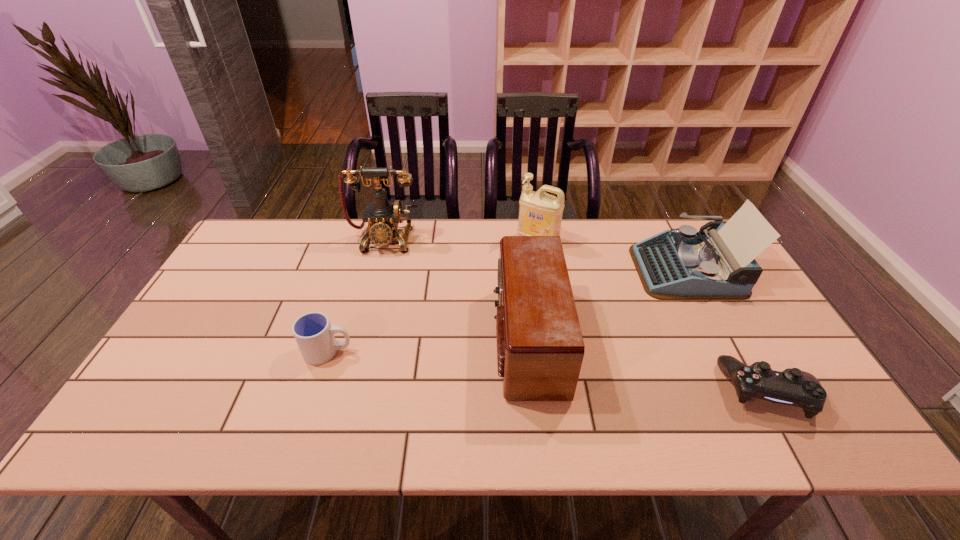
I want to click on vacant point located between the radio receiver and the typewriter, so click(x=607, y=304).

This screenshot has width=960, height=540. What are the coordinates of `vacant space that's between the radio receiver and the control` in the screenshot? It's located at (648, 365).

The width and height of the screenshot is (960, 540). What are the coordinates of `free space that is in between the typewriter and the control` in the screenshot? It's located at (728, 330).

Identify the location of unoccupied position between the control and the typewriter. The height and width of the screenshot is (540, 960). (728, 330).

The width and height of the screenshot is (960, 540). Identify the location of object identified as the second closest to the cup. (540, 348).

Identify which object is the second nearest to the telephone. Please provide its 2D coordinates. Your answer should be formatted as a tuple, i.e. [(x, y)], where the tuple contains the x and y coordinates of a point satisfying the conditions above.

[(540, 214)]

Where is `vacant space that satisfies the following two spatial constraints: 1. on the front of the detergent, featuring the rotary dial; 2. on the right side of the telephone`? This screenshot has width=960, height=540. vacant space that satisfies the following two spatial constraints: 1. on the front of the detergent, featuring the rotary dial; 2. on the right side of the telephone is located at coordinates (384, 241).

Identify the location of free location that satisfies the following two spatial constraints: 1. on the front of the telephone, featuring the rotary dial; 2. on the left side of the control. Image resolution: width=960 pixels, height=540 pixels. (345, 392).

You are a GUI agent. You are given a task and a screenshot of the screen. Output one action in this format:
    pyautogui.click(x=<x>, y=<y>)
    Task: Click on the vacant space that satisfies the following two spatial constraints: 1. with the handle on the side of the control; 2. on the right side of the cup
    
    Given the screenshot: What is the action you would take?
    (x=315, y=392)

Locate an element on the screen. This screenshot has width=960, height=540. vacant space that satisfies the following two spatial constraints: 1. on the front-facing side of the control; 2. on the left side of the radio receiver is located at coordinates (533, 392).